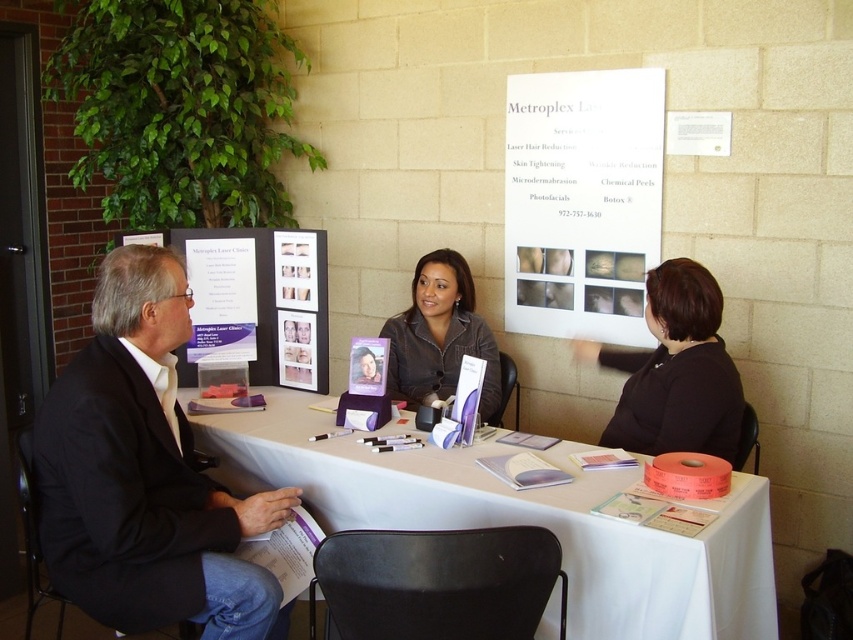
Question: Is black suit at left positioned behind matte plastic photo frame at center?

Choices:
 (A) no
 (B) yes

Answer: (A)

Question: Does white paper at upper center appear on the left side of matte plastic photo frames at center?

Choices:
 (A) yes
 (B) no

Answer: (B)

Question: Which of these objects is positioned farthest from the matte plastic photo frame at center?

Choices:
 (A) black suit at left
 (B) black matte shirt at center

Answer: (B)

Question: Which point is farther from the camera taking this photo?

Choices:
 (A) [x=225, y=536]
 (B) [x=187, y=240]
 (C) [x=547, y=227]

Answer: (C)

Question: Does black suit at left appear over black matte shirt at center?

Choices:
 (A) yes
 (B) no

Answer: (B)

Question: Which object is closer to the camera taking this photo?

Choices:
 (A) white paper table at lower center
 (B) matte plastic photo frames at center

Answer: (A)